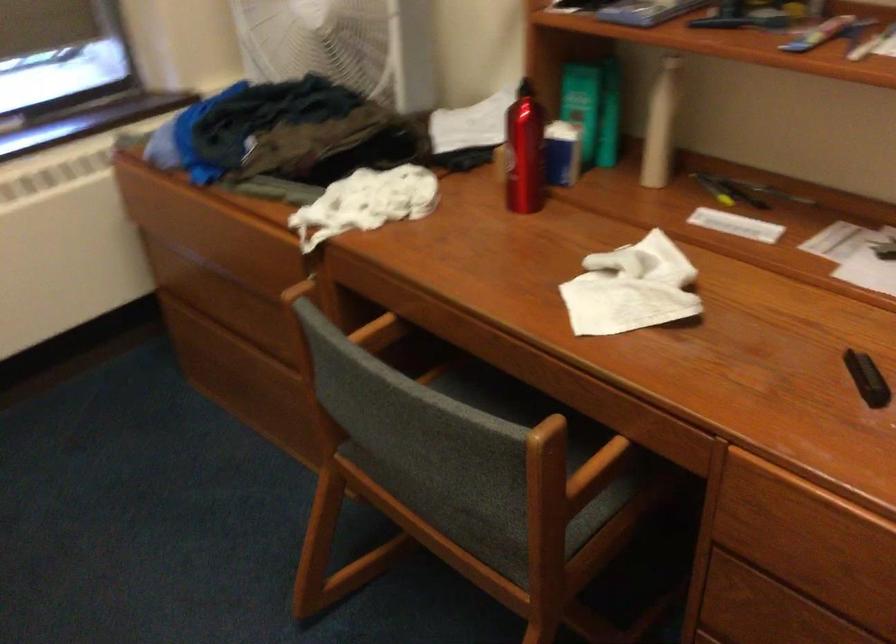
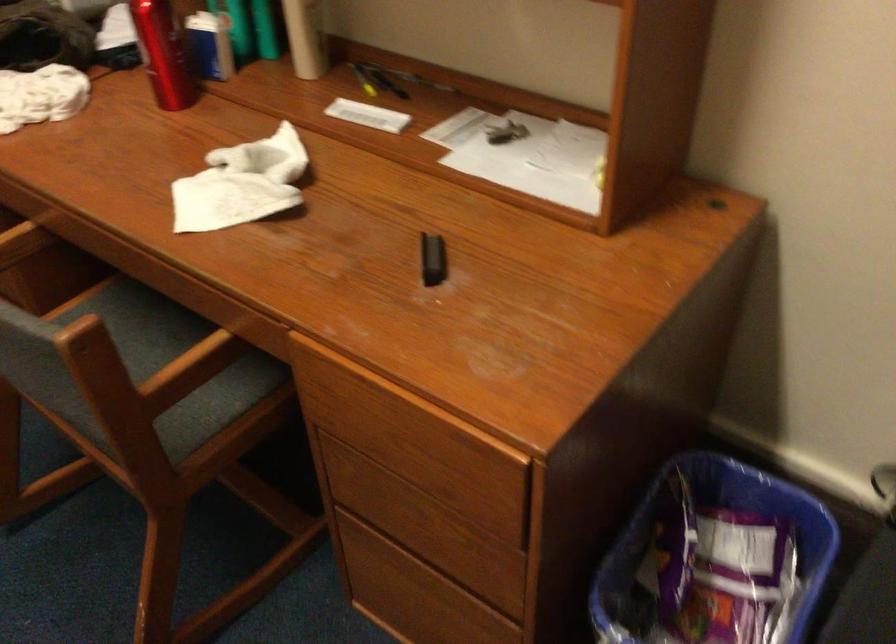
In the second image, find the point that corresponds to (714,185) in the first image.

(363, 80)